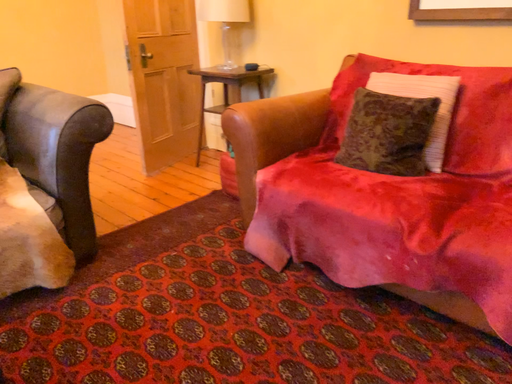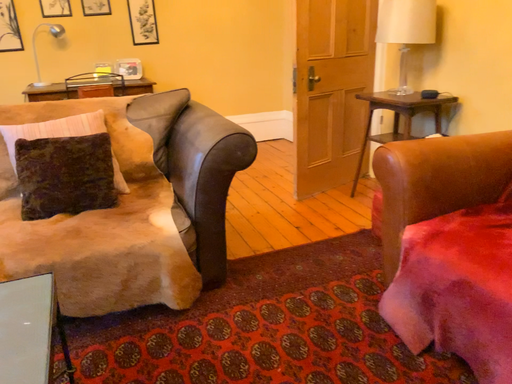
Question: How did the camera likely rotate when shooting the video?

Choices:
 (A) rotated left
 (B) rotated right

Answer: (A)